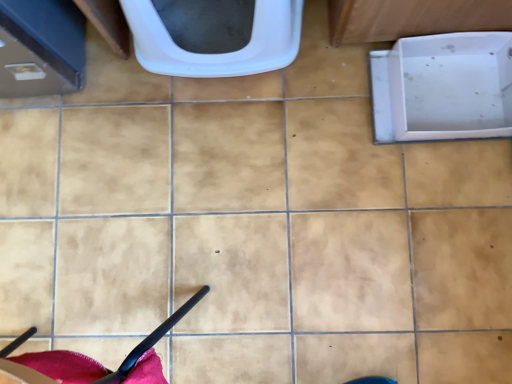
Question: Would you say white plastic toilet at upper center is to the left or to the right of white plastic bath at right in the picture?

Choices:
 (A) left
 (B) right

Answer: (A)

Question: From a real-world perspective, relative to white plastic bath at right, is white plastic toilet at upper center vertically above or below?

Choices:
 (A) below
 (B) above

Answer: (B)

Question: Is point (144, 44) positioned closer to the camera than point (416, 107)?

Choices:
 (A) farther
 (B) closer

Answer: (B)

Question: Based on their sizes in the image, would you say white plastic bath at right is bigger or smaller than white plastic toilet at upper center?

Choices:
 (A) big
 (B) small

Answer: (B)

Question: From their relative heights in the image, would you say white plastic bath at right is taller or shorter than white plastic toilet at upper center?

Choices:
 (A) tall
 (B) short

Answer: (B)

Question: Would you say white plastic bath at right is inside or outside white plastic toilet at upper center?

Choices:
 (A) inside
 (B) outside

Answer: (B)

Question: From a real-world perspective, is white plastic bath at right above or below white plastic toilet at upper center?

Choices:
 (A) above
 (B) below

Answer: (B)